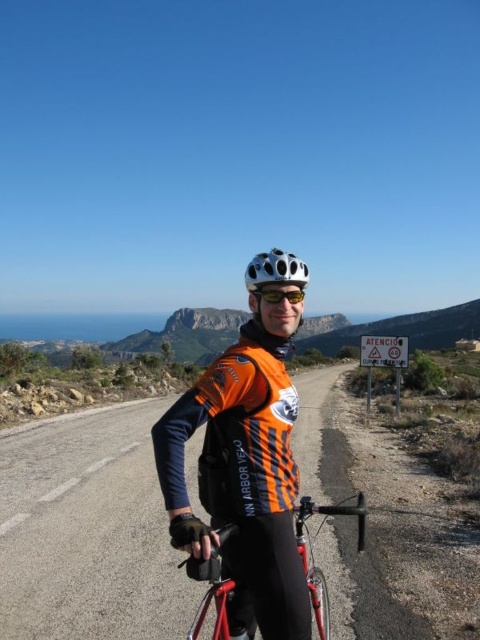
You are a photographer standing at the starting point of a cycling event. You want to capture a photo of the shiny red bicycle at center from a distance where the bicycle will appear sharp without any blur. According to the depth of field guidelines, the minimum focusing distance required for a bicycle of this size is 2.5 meters. Can you take the photo from your current position?

The shiny red bicycle at center is 2.64 meters away from the camera. Since the minimum focusing distance required is 2.5 meters, you can take the photo from your current position as the distance is sufficient.

You are a delivery person who needs to secure a package on the shiny red bicycle at center and the white matte bicycle helmet at center. Considering their sizes, which object might be more challenging to attach the package to?

A: The shiny red bicycle at center has a smaller size compared to the white matte bicycle helmet at center, so attaching a package to the smaller shiny red bicycle at center might be more challenging due to limited space.

You are a cyclist who wants to check if your shiny orange cycling jersey at center is within reach while riding your shiny red bicycle at center. The handlebars are 2.5 feet wide. Can you safely reach your jersey without losing balance?

The distance between the shiny orange cycling jersey at center and the shiny red bicycle at center is 9.26 feet, which is much greater than the handlebars width of 2.5 feet. Therefore, you cannot safely reach the jersey while riding without losing balance.